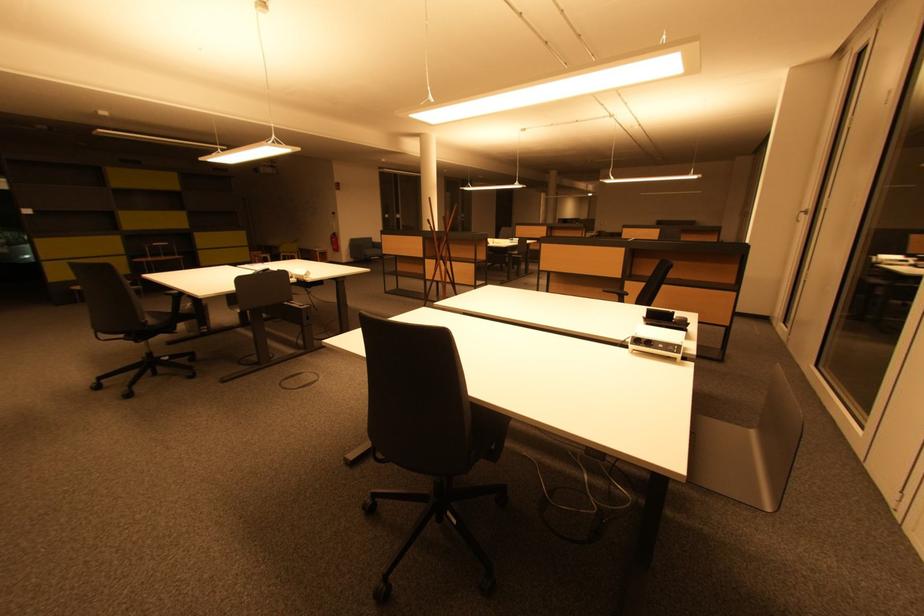
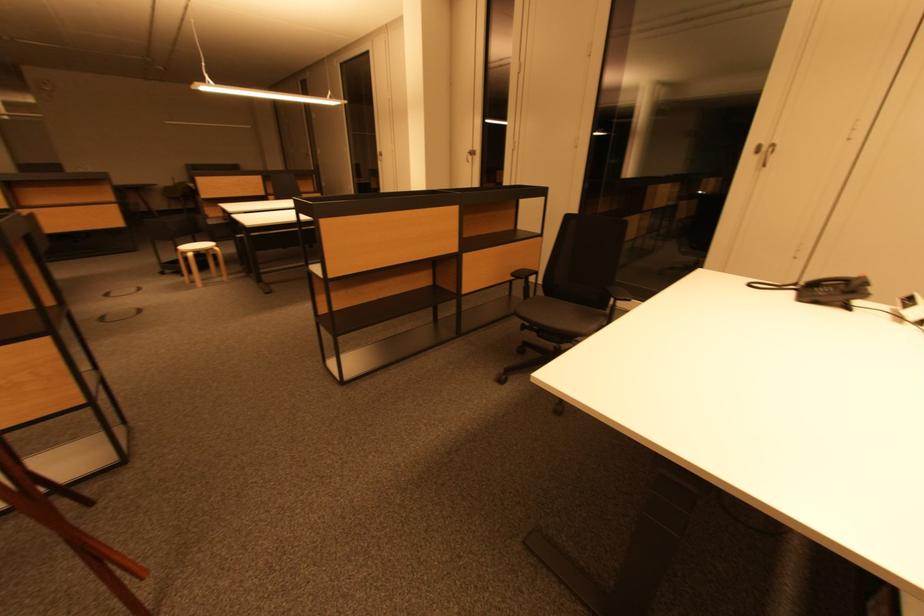
In the second image, find the point that corresponds to (808,212) in the first image.

(470, 152)